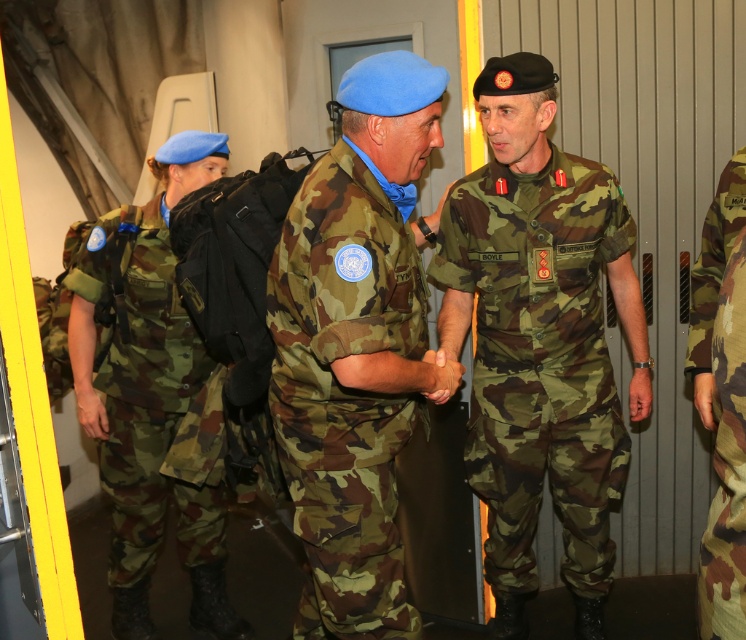
You are a photographer positioned at the back of the transport vehicle. You need to take a photo of both the camo fabric uniform at center and the camo fabric uniform at left. Which one should you focus on first to ensure both are in the frame?

You should focus on the camo fabric uniform at center first since it is in front of the camo fabric uniform at left, ensuring both are visible in the frame.

You are a photographer positioned at the front of the transport vehicle. You want to take a photo that includes both the camouflage fabric uniform at center and the camouflage fabric uniform at right. Which one should you focus on first to ensure both are in the frame?

The camouflage fabric uniform at center should be focused on first because the camouflage fabric uniform at right is behind it, so adjusting the frame to include the one in front ensures the one behind is also captured.